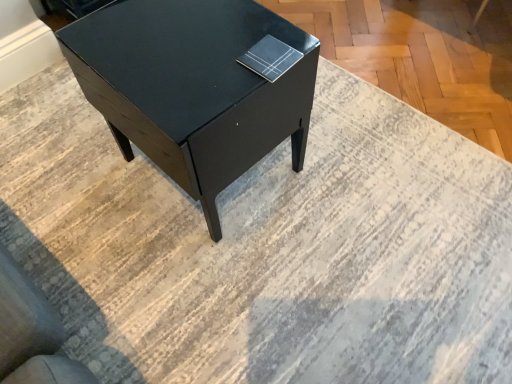
Question: From a real-world perspective, is matte black book at upper right positioned under matte black table at center based on gravity?

Choices:
 (A) yes
 (B) no

Answer: (B)

Question: Is the position of matte black book at upper right more distant than that of matte black table at center?

Choices:
 (A) yes
 (B) no

Answer: (A)

Question: Can you confirm if matte black book at upper right is wider than matte black table at center?

Choices:
 (A) no
 (B) yes

Answer: (A)

Question: Is matte black book at upper right to the right of matte black table at center from the viewer's perspective?

Choices:
 (A) no
 (B) yes

Answer: (B)

Question: Is matte black table at center surrounded by matte black book at upper right?

Choices:
 (A) yes
 (B) no

Answer: (B)

Question: Considering the relative sizes of matte black book at upper right and matte black table at center in the image provided, is matte black book at upper right bigger than matte black table at center?

Choices:
 (A) yes
 (B) no

Answer: (B)

Question: Is matte black table at center closer to the viewer compared to matte black book at upper right?

Choices:
 (A) no
 (B) yes

Answer: (B)

Question: Is matte black table at center next to matte black book at upper right and touching it?

Choices:
 (A) no
 (B) yes

Answer: (A)

Question: Does matte black table at center have a greater height compared to matte black book at upper right?

Choices:
 (A) no
 (B) yes

Answer: (B)

Question: Is matte black table at center surrounding matte black book at upper right?

Choices:
 (A) yes
 (B) no

Answer: (B)

Question: Considering the relative sizes of matte black table at center and matte black book at upper right in the image provided, is matte black table at center thinner than matte black book at upper right?

Choices:
 (A) no
 (B) yes

Answer: (A)

Question: From the image's perspective, would you say matte black table at center is shown under matte black book at upper right?

Choices:
 (A) yes
 (B) no

Answer: (A)

Question: In the image, is matte black table at center on the left side or the right side of matte black book at upper right?

Choices:
 (A) left
 (B) right

Answer: (A)